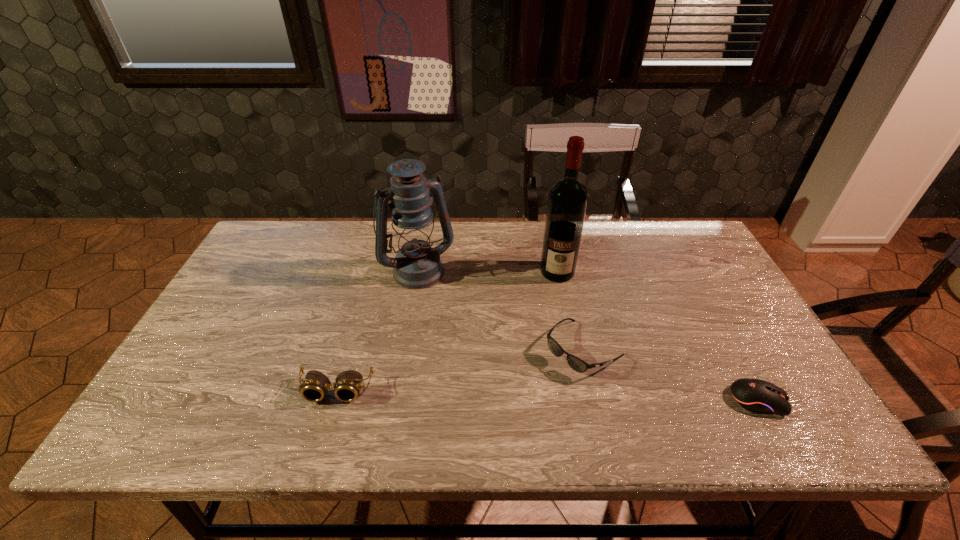
Where is `free space on the desktop that is between the goggles and the rightmost object and is positioned on the front-facing side of the second tallest object`? Image resolution: width=960 pixels, height=540 pixels. free space on the desktop that is between the goggles and the rightmost object and is positioned on the front-facing side of the second tallest object is located at coordinates (491, 394).

At what (x,y) coordinates should I click in order to perform the action: click on free space on the desktop that is between the goggles and the shortest object and is positioned on the front-facing side of the sunglasses. Please return your answer as a coordinate pair (x, y). Looking at the image, I should click on (528, 395).

I want to click on free spot on the desktop that is between the goggles and the rightmost object and is positioned on the front and back of the alcohol, so click(x=555, y=396).